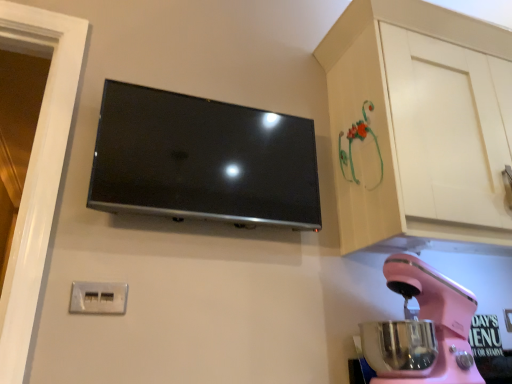
Question: From a real-world perspective, is pink plastic stand mixer at lower right beneath white plastic electrical outlet at lower left?

Choices:
 (A) no
 (B) yes

Answer: (B)

Question: Can you confirm if pink plastic stand mixer at lower right is positioned to the right of white plastic electrical outlet at lower left?

Choices:
 (A) no
 (B) yes

Answer: (B)

Question: Considering the relative sizes of pink plastic stand mixer at lower right and white plastic electrical outlet at lower left in the image provided, is pink plastic stand mixer at lower right smaller than white plastic electrical outlet at lower left?

Choices:
 (A) no
 (B) yes

Answer: (A)

Question: Would you consider pink plastic stand mixer at lower right to be distant from white plastic electrical outlet at lower left?

Choices:
 (A) yes
 (B) no

Answer: (B)

Question: Could you tell me if pink plastic stand mixer at lower right is turned towards white plastic electrical outlet at lower left?

Choices:
 (A) yes
 (B) no

Answer: (A)

Question: Is pink plastic stand mixer at lower right in front of or behind matte black tv at upper center in the image?

Choices:
 (A) behind
 (B) front

Answer: (B)

Question: Is pink plastic stand mixer at lower right bigger or smaller than matte black tv at upper center?

Choices:
 (A) small
 (B) big

Answer: (B)

Question: Considering the positions of pink plastic stand mixer at lower right and matte black tv at upper center in the image, is pink plastic stand mixer at lower right wider or thinner than matte black tv at upper center?

Choices:
 (A) thin
 (B) wide

Answer: (B)

Question: From a real-world perspective, is pink plastic stand mixer at lower right physically located above or below matte black tv at upper center?

Choices:
 (A) above
 (B) below

Answer: (B)

Question: Does point (342, 167) appear closer or farther from the camera than point (84, 286)?

Choices:
 (A) farther
 (B) closer

Answer: (A)

Question: Is matte white cabinet at upper right in front of or behind white plastic electrical outlet at lower left in the image?

Choices:
 (A) front
 (B) behind

Answer: (A)

Question: Considering the positions of matte white cabinet at upper right and white plastic electrical outlet at lower left in the image, is matte white cabinet at upper right wider or thinner than white plastic electrical outlet at lower left?

Choices:
 (A) wide
 (B) thin

Answer: (A)

Question: Is matte white cabinet at upper right situated inside white plastic electrical outlet at lower left or outside?

Choices:
 (A) inside
 (B) outside

Answer: (B)

Question: Looking at the image, does pink plastic stand mixer at lower right seem bigger or smaller compared to matte white cabinet at upper right?

Choices:
 (A) big
 (B) small

Answer: (B)

Question: From the image's perspective, is pink plastic stand mixer at lower right above or below matte white cabinet at upper right?

Choices:
 (A) below
 (B) above

Answer: (A)